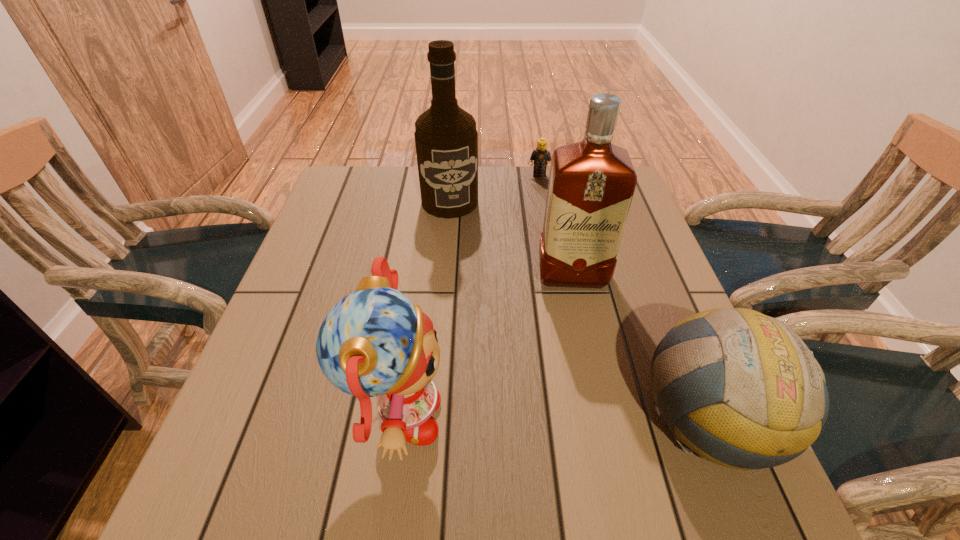
At what (x,y) coordinates should I click in order to perform the action: click on vacant region between the volleyball and the doll. Please return your answer as a coordinate pair (x, y). This screenshot has width=960, height=540. Looking at the image, I should click on (556, 420).

Locate an element on the screen. free spot between the second farthest object and the Lego is located at coordinates (494, 188).

The width and height of the screenshot is (960, 540). What are the coordinates of `vacant point located between the third shortest object and the liquor` in the screenshot? It's located at (485, 348).

What are the coordinates of `free space that is in between the shortest object and the volleyball` in the screenshot? It's located at (626, 297).

The image size is (960, 540). What are the coordinates of `unoccupied area between the fourth tallest object and the third tallest object` in the screenshot? It's located at (556, 420).

Locate an element on the screen. vacant area between the Lego and the second farthest object is located at coordinates (494, 188).

Identify the location of object that ranks as the second closest to the Lego. This screenshot has height=540, width=960. (591, 184).

Locate an element on the screen. This screenshot has height=540, width=960. object that is the nearest to the fourth tallest object is located at coordinates (591, 184).

At what (x,y) coordinates should I click in order to perform the action: click on vacant space that satisfies the following two spatial constraints: 1. on the front side of the third nearest object; 2. on the left side of the Lego. Please return your answer as a coordinate pair (x, y). The image size is (960, 540). Looking at the image, I should click on click(557, 275).

Identify the location of free spot that satisfies the following two spatial constraints: 1. on the front side of the third farthest object; 2. on the right side of the shortest object. The image size is (960, 540). (557, 275).